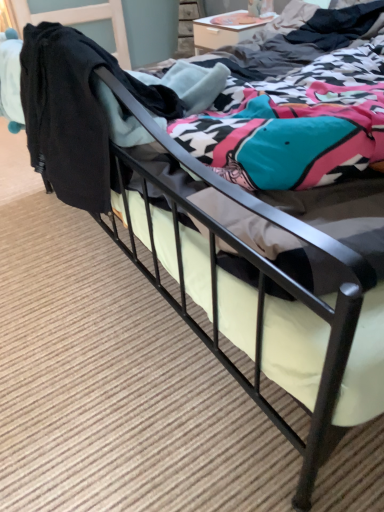
This screenshot has width=384, height=512. In order to click on black fabric at left in this screenshot , I will do `click(76, 112)`.

This screenshot has height=512, width=384. Describe the element at coordinates (76, 112) in the screenshot. I see `black fabric at left` at that location.

The height and width of the screenshot is (512, 384). Identify the location of black fabric at left. (76, 112).